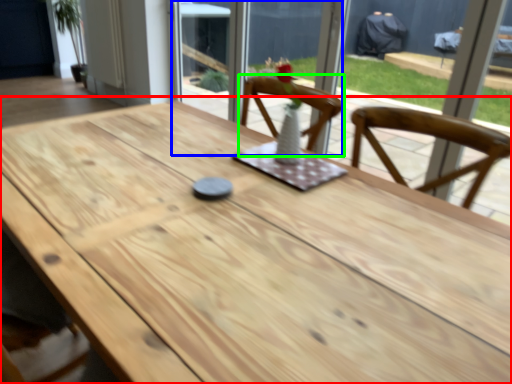
Question: Considering the real-world distances, which object is farthest from table (highlighted by a red box)? screen door (highlighted by a blue box) or chair (highlighted by a green box)?

Choices:
 (A) screen door
 (B) chair

Answer: (A)